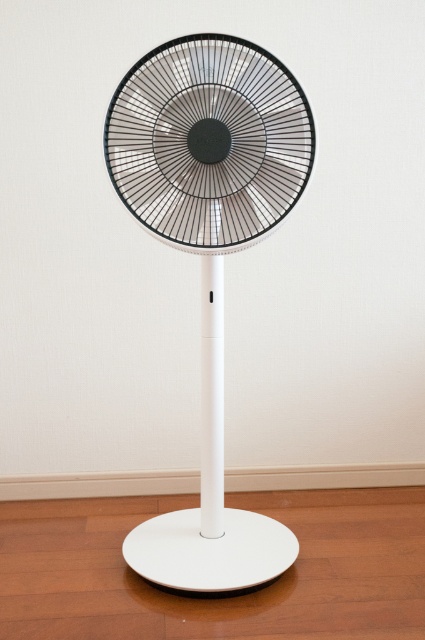
Question: Can you confirm if white plastic fan at center is bigger than black matte fan at center?

Choices:
 (A) yes
 (B) no

Answer: (A)

Question: Which object appears closest to the camera in this image?

Choices:
 (A) black matte fan at center
 (B) white plastic fan at center

Answer: (A)

Question: In this image, where is white plastic fan at center located relative to black matte fan at center?

Choices:
 (A) below
 (B) above

Answer: (A)

Question: Which point is closer to the camera?

Choices:
 (A) (217, 204)
 (B) (251, 225)

Answer: (B)

Question: Which object appears closest to the camera in this image?

Choices:
 (A) white plastic fan at center
 (B) black matte fan at center

Answer: (B)

Question: Can you confirm if white plastic fan at center is positioned to the right of black matte fan at center?

Choices:
 (A) no
 (B) yes

Answer: (A)